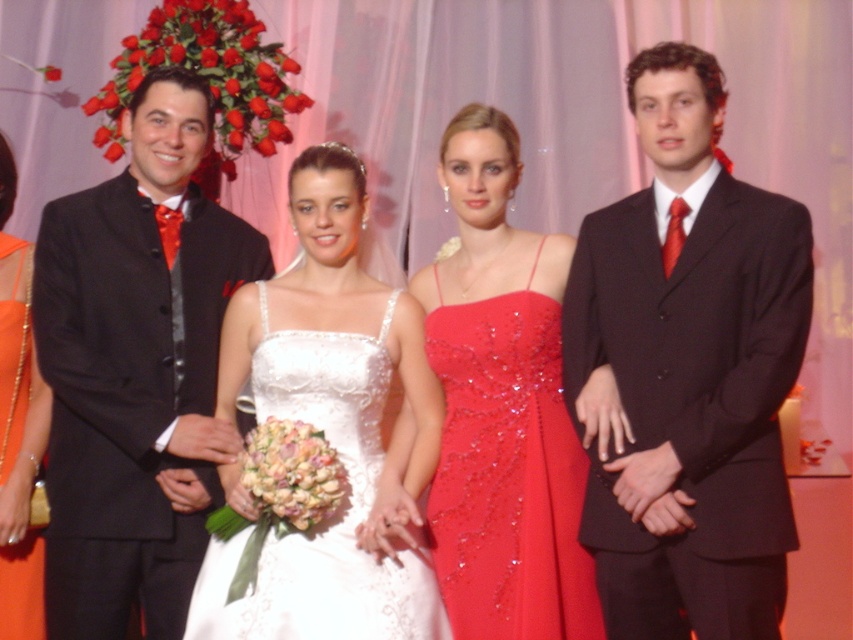
Does shiny sequined dress at center come behind orange satin dress at left?

That is False.

From the picture: Can you confirm if shiny sequined dress at center is bigger than orange satin dress at left?

Yes, shiny sequined dress at center is bigger than orange satin dress at left.

Who is more forward, (573, 493) or (39, 602)?

Point (573, 493) is more forward.

This screenshot has width=853, height=640. In order to click on shiny sequined dress at center in this screenshot , I will do `click(508, 472)`.

Is point (664, 180) behind point (415, 573)?

No.

Can you confirm if shiny black suit at right is thinner than satin white dress at center?

Yes.

What are the coordinates of `shiny black suit at right` in the screenshot? It's located at (688, 371).

Identify the location of shiny black suit at right. (688, 371).

The height and width of the screenshot is (640, 853). What do you see at coordinates (688, 371) in the screenshot? I see `shiny black suit at right` at bounding box center [688, 371].

Find the location of a particular element. shiny black suit at right is located at coordinates (688, 371).